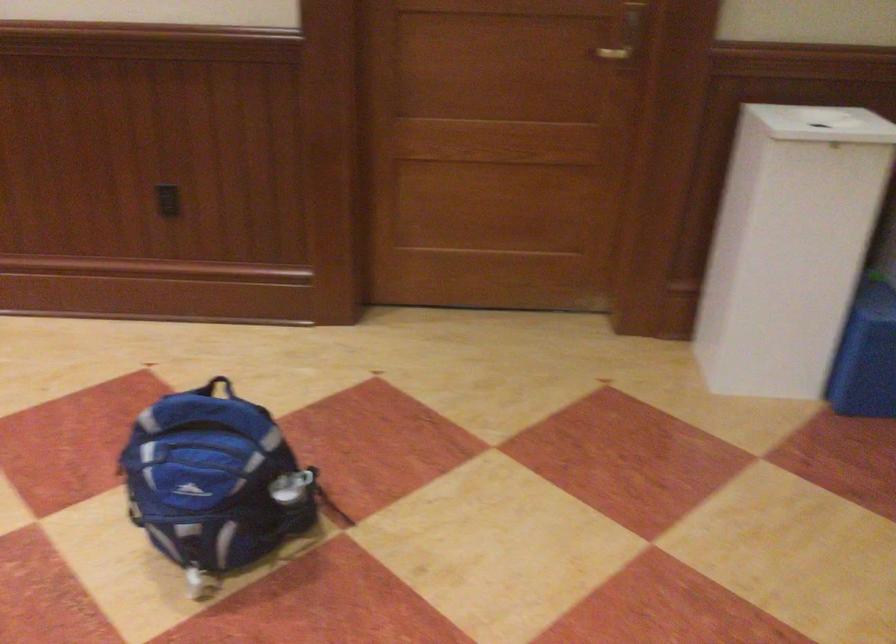
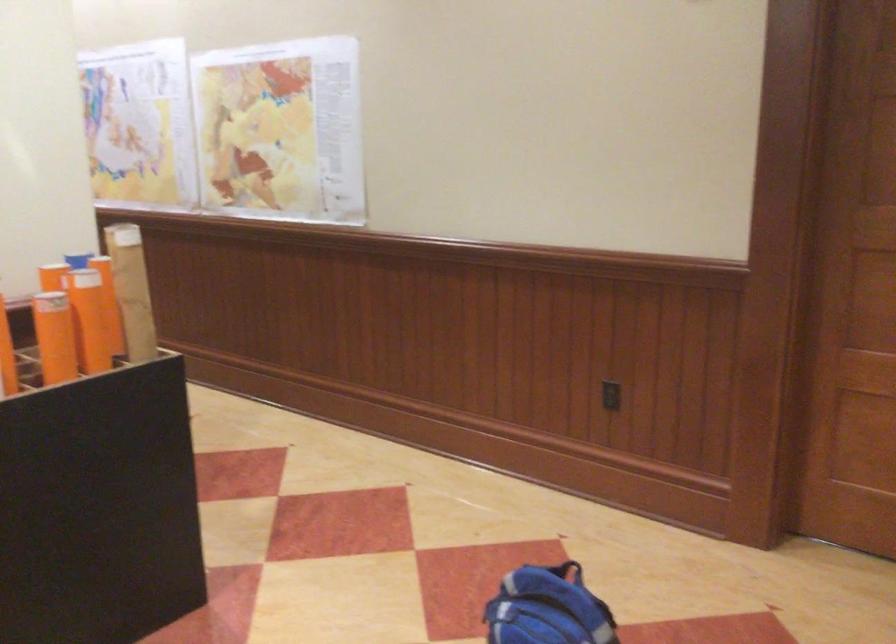
Locate, in the second image, the point that corresponds to (x=174, y=200) in the first image.

(609, 395)